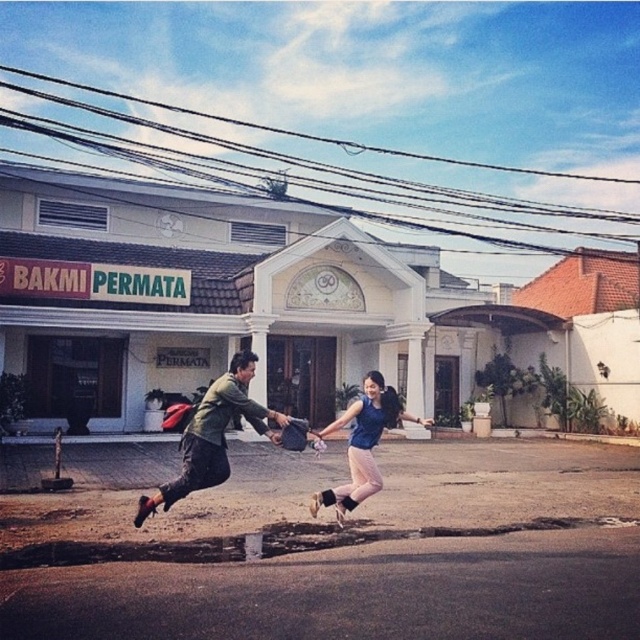
Question: Does green matte jacket at center come behind blue fabric dress at center?

Choices:
 (A) yes
 (B) no

Answer: (B)

Question: Which of the following is the closest to the observer?

Choices:
 (A) blue fabric dress at center
 (B) brown asphalt puddle at lower center
 (C) green matte jacket at center

Answer: (B)

Question: Which point is closer to the camera?

Choices:
 (A) green matte jacket at center
 (B) blue fabric dress at center

Answer: (A)

Question: Does brown asphalt puddle at lower center appear on the right side of blue fabric dress at center?

Choices:
 (A) yes
 (B) no

Answer: (B)

Question: Is brown asphalt puddle at lower center bigger than blue fabric dress at center?

Choices:
 (A) no
 (B) yes

Answer: (A)

Question: Which of the following is the farthest from the observer?

Choices:
 (A) blue fabric dress at center
 (B) green matte jacket at center
 (C) brown asphalt puddle at lower center

Answer: (A)